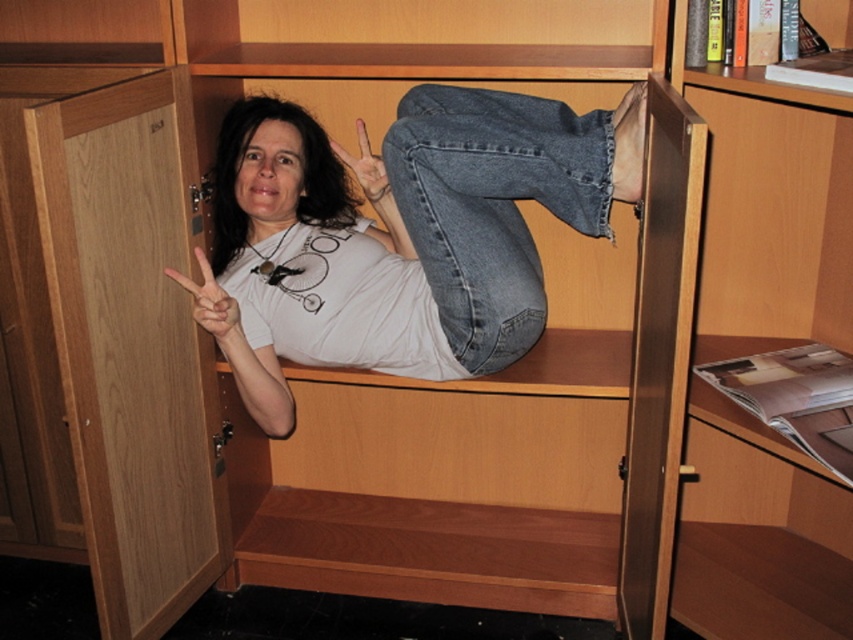
Question: Which object is farther from the camera taking this photo?

Choices:
 (A) denim at center
 (B) white matte hand at center

Answer: (B)

Question: Where is white matte t-shirt at center located in relation to white matte hand at center in the image?

Choices:
 (A) below
 (B) above

Answer: (B)

Question: Can you confirm if white matte t-shirt at center is smaller than matte white hand at center?

Choices:
 (A) no
 (B) yes

Answer: (A)

Question: In this image, where is denim at center located relative to matte white hand at center?

Choices:
 (A) above
 (B) below

Answer: (B)

Question: Among these objects, which one is nearest to the camera?

Choices:
 (A) matte white hand at center
 (B) white matte hand at center
 (C) denim at center
 (D) white matte t-shirt at center

Answer: (C)

Question: Estimate the real-world distances between objects in this image. Which object is closer to the white matte hand at center?

Choices:
 (A) denim at center
 (B) white matte t-shirt at center
 (C) matte white hand at center

Answer: (B)